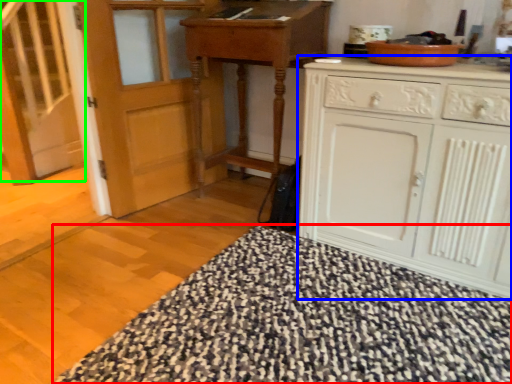
Question: Based on their relative distances, which object is farther from blanket (highlighted by a red box)? Choose from cabinetry (highlighted by a blue box) and stairs (highlighted by a green box).

Choices:
 (A) cabinetry
 (B) stairs

Answer: (B)